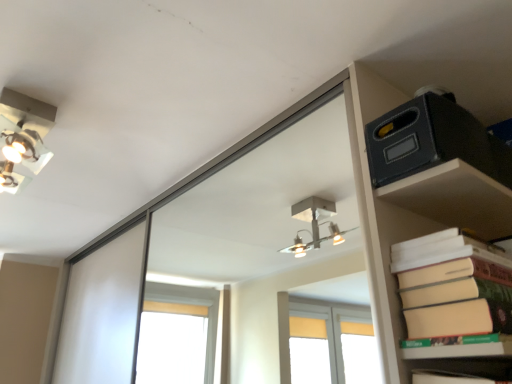
The image size is (512, 384). In order to click on beige matte paper at right in this screenshot , I will do `click(453, 287)`.

Based on the photo, from a real-world perspective, which object rests below the other?

matte black box at upper right.

Does point (476, 174) come farther from viewer compared to point (42, 144)?

No, it is not.

Considering the relative positions of matte black box at upper right and metallic silver light fixture at upper left in the image provided, is matte black box at upper right behind metallic silver light fixture at upper left?

No, the depth of matte black box at upper right is less than that of metallic silver light fixture at upper left.

Is there a large distance between matte black box at upper right and metallic silver light fixture at upper left?

No, matte black box at upper right is not far away from metallic silver light fixture at upper left.

Is matte black box at upper right closer to camera compared to beige matte paper at right?

That is False.

Is matte black box at upper right oriented towards beige matte paper at right?

No, matte black box at upper right is not oriented towards beige matte paper at right.

What's the angular difference between matte black box at upper right and beige matte paper at right's facing directions?

2.69 degrees separate the facing orientations of matte black box at upper right and beige matte paper at right.

Is matte black box at upper right directly adjacent to beige matte paper at right?

No, matte black box at upper right is not in contact with beige matte paper at right.

Would you say beige matte paper at right is a long distance from metallic silver light fixture at upper left?

No, beige matte paper at right is not far from metallic silver light fixture at upper left.

Is beige matte paper at right wider or thinner than metallic silver light fixture at upper left?

Clearly, beige matte paper at right has less width compared to metallic silver light fixture at upper left.

Does beige matte paper at right contain metallic silver light fixture at upper left?

No, metallic silver light fixture at upper left is not surrounded by beige matte paper at right.

Based on the photo, is metallic silver light fixture at upper left at the back of beige matte paper at right?

No, beige matte paper at right is not facing the opposite direction of metallic silver light fixture at upper left.

Between metallic silver light fixture at upper left and beige matte paper at right, which one has less height?

Standing shorter between the two is metallic silver light fixture at upper left.

Considering the positions of objects metallic silver light fixture at upper left and beige matte paper at right in the image provided, who is in front, metallic silver light fixture at upper left or beige matte paper at right?

beige matte paper at right is closer to the camera.

From the image's perspective, who appears lower, metallic silver light fixture at upper left or beige matte paper at right?

beige matte paper at right appears lower in the image.

Is metallic silver light fixture at upper left smaller than beige matte paper at right?

Yes, metallic silver light fixture at upper left is smaller than beige matte paper at right.

Which object is more forward, metallic silver light fixture at upper left or matte black box at upper right?

matte black box at upper right is more forward.

From the image's perspective, is metallic silver light fixture at upper left located beneath matte black box at upper right?

Incorrect, from the image's perspective, metallic silver light fixture at upper left is higher than matte black box at upper right.

Can you see metallic silver light fixture at upper left touching matte black box at upper right?

No, metallic silver light fixture at upper left is not next to matte black box at upper right.

How much distance is there between beige matte paper at right and matte black box at upper right?

They are 5.45 inches apart.

Which of these two, beige matte paper at right or matte black box at upper right, stands taller?

With more height is beige matte paper at right.

Is beige matte paper at right facing towards matte black box at upper right?

No, beige matte paper at right is not turned towards matte black box at upper right.

From the image's perspective, which one is positioned lower, beige matte paper at right or matte black box at upper right?

From the image's view, beige matte paper at right is below.

Find the location of a particular element. lamp that appears above the matte black box at upper right (from a real-world perspective) is located at coordinates (22, 139).

You are a GUI agent. You are given a task and a screenshot of the screen. Output one action in this format:
    pyautogui.click(x=<x>, y=<y>)
    Task: Click on the paperback book on the right of matte black box at upper right
    
    Given the screenshot: What is the action you would take?
    pyautogui.click(x=453, y=287)

Considering their positions, is beige matte paper at right positioned closer to matte black box at upper right than metallic silver light fixture at upper left?

beige matte paper at right.

Considering their positions, is matte black box at upper right positioned further to beige matte paper at right than metallic silver light fixture at upper left?

The object further to beige matte paper at right is metallic silver light fixture at upper left.

Considering their positions, is metallic silver light fixture at upper left positioned further to beige matte paper at right than matte black box at upper right?

metallic silver light fixture at upper left lies further to beige matte paper at right than the other object.

Looking at this image, based on their spatial positions, is metallic silver light fixture at upper left or beige matte paper at right closer to matte black box at upper right?

beige matte paper at right.

Based on their spatial positions, is beige matte paper at right or matte black box at upper right closer to metallic silver light fixture at upper left?

matte black box at upper right.

Looking at the image, which one is located further to metallic silver light fixture at upper left, matte black box at upper right or beige matte paper at right?

beige matte paper at right is further to metallic silver light fixture at upper left.

Where is `shelf situated between metallic silver light fixture at upper left and beige matte paper at right from left to right`? The width and height of the screenshot is (512, 384). shelf situated between metallic silver light fixture at upper left and beige matte paper at right from left to right is located at coordinates (419, 225).